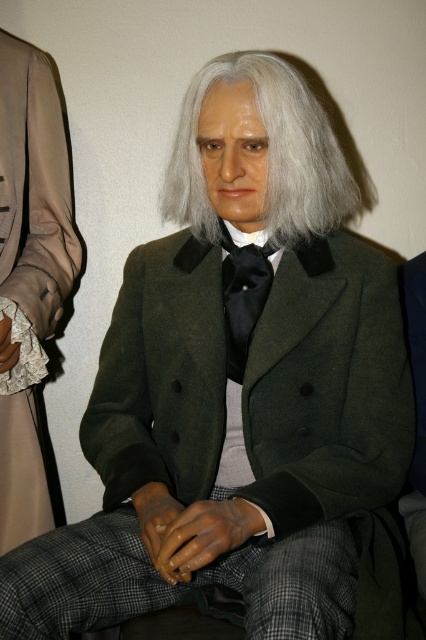
Is green woolen coat at center thinner than gray matte hair at center?

No, green woolen coat at center is not thinner than gray matte hair at center.

From the picture: Is green woolen coat at center wider than gray matte hair at center?

Yes, green woolen coat at center is wider than gray matte hair at center.

Is point (187, 348) farther from viewer compared to point (281, 243)?

That is True.

This screenshot has height=640, width=426. I want to click on green woolen coat at center, so click(x=328, y=390).

Looking at this image, does gray matte hair at center come in front of black satin tie at center?

Yes.

Does point (256, 65) lie in front of point (253, 294)?

That is True.

Is point (252, 84) positioned in front of point (230, 289)?

Yes, it is in front of point (230, 289).

What are the coordinates of `gray matte hair at center` in the screenshot? It's located at (267, 156).

Who is positioned more to the right, lace fabric at left or black satin tie at center?

Positioned to the right is black satin tie at center.

Does lace fabric at left come in front of black satin tie at center?

No, it is behind black satin tie at center.

Is point (20, 148) in front of point (227, 376)?

No.

This screenshot has height=640, width=426. Identify the location of lace fabric at left. (29, 275).